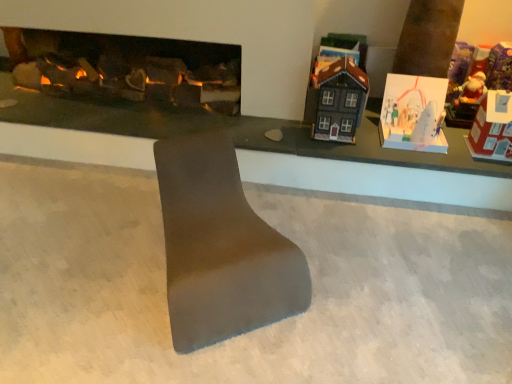
The width and height of the screenshot is (512, 384). Identify the location of free spot in front of white paper card at upper right, the 3th toy in the left-to-right sequence. (425, 156).